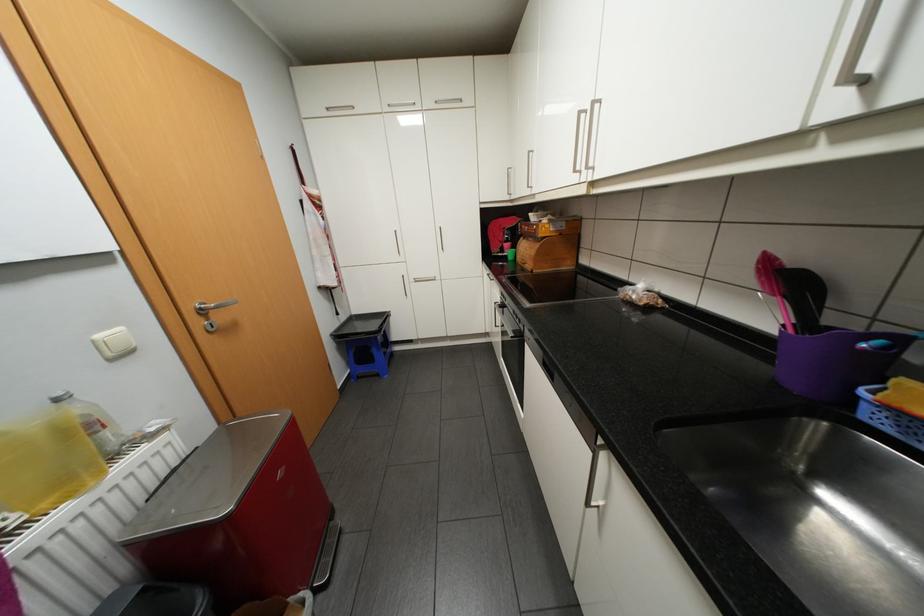
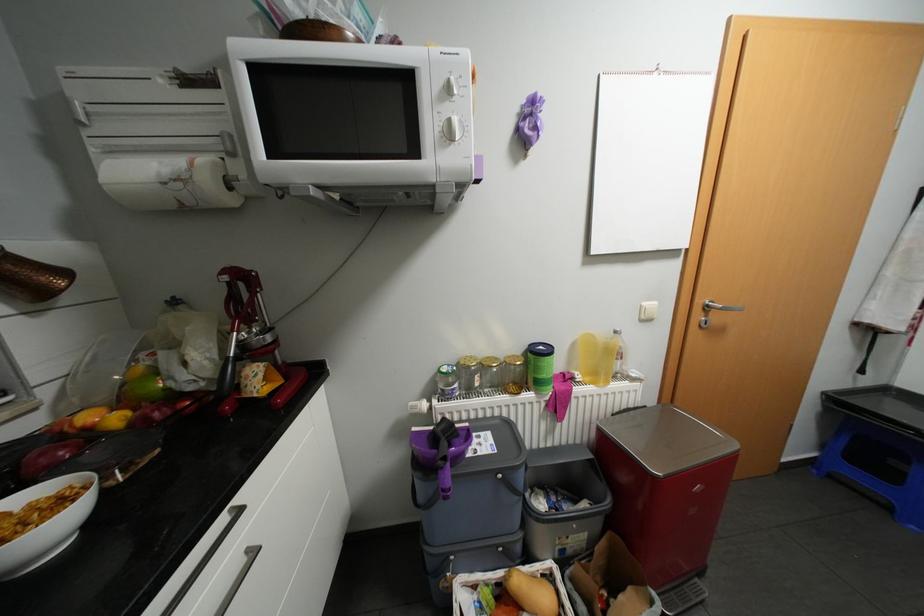
Find the pixel in the second image that matches point (119, 359) in the first image.

(649, 320)